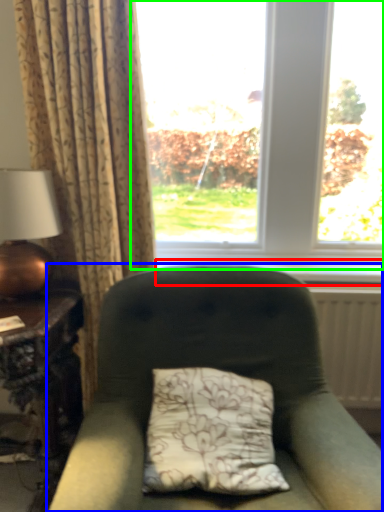
Question: Which object is positioned closest to window sill (highlighted by a red box)? Select from chair (highlighted by a blue box) and window (highlighted by a green box).

Choices:
 (A) chair
 (B) window

Answer: (B)